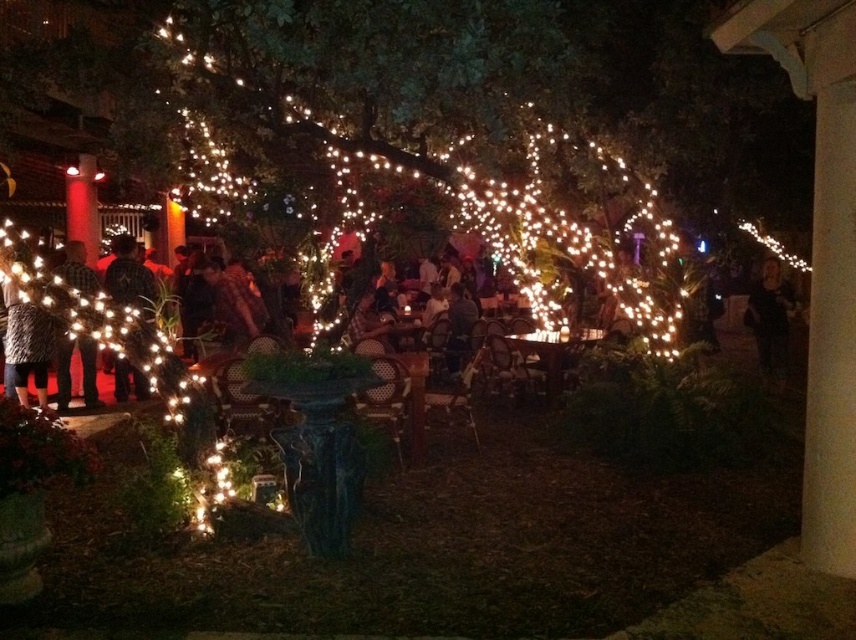
You are organizing a coat rack at the entrance of the gathering. You see the dark brown leather jacket at left and the dark plaid shirt at left. Which one should you hang first to ensure both fit properly?

The dark brown leather jacket at left is positioned over the dark plaid shirt at left, so you should hang the dark plaid shirt at left first to make space for the jacket.

You are at an outdoor evening gathering and see two people wearing the dark gray sweater at left and the dark plaid shirt at left. If you want to greet the person closer to you, which one should you approach?

You should approach the dark gray sweater at left because it is in front of the dark plaid shirt at left, meaning the person wearing it is closer to you.